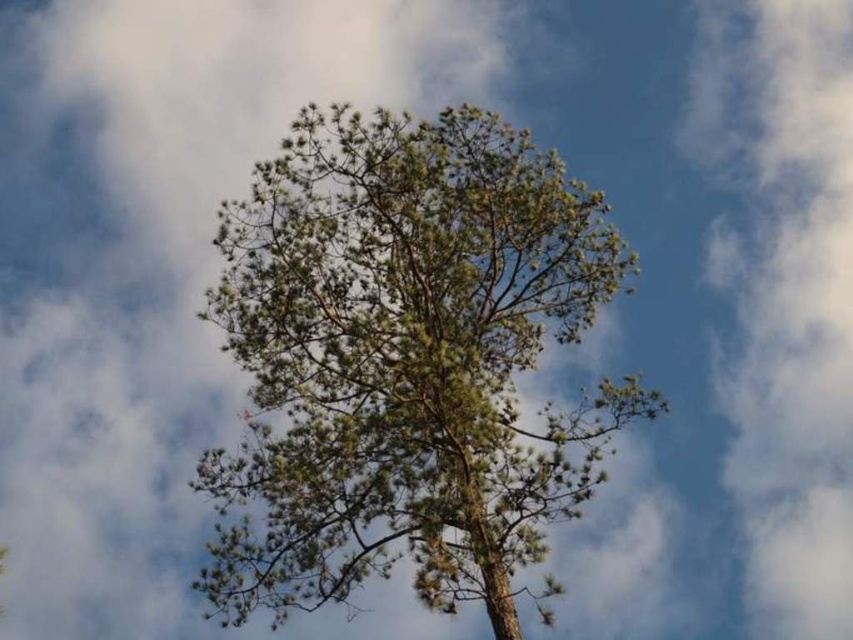
Question: In this image, where is green leafy tree at center located relative to white fluffy cloud at upper right?

Choices:
 (A) below
 (B) above

Answer: (B)

Question: Does green leafy tree at center have a lesser width compared to white fluffy cloud at upper right?

Choices:
 (A) yes
 (B) no

Answer: (B)

Question: Which object is closer to the camera taking this photo?

Choices:
 (A) green leafy tree at center
 (B) white fluffy cloud at upper right

Answer: (A)

Question: Which of the following is the farthest from the observer?

Choices:
 (A) click(x=773, y=536)
 (B) click(x=376, y=531)

Answer: (A)

Question: Among these objects, which one is farthest from the camera?

Choices:
 (A) white fluffy cloud at upper right
 (B) green leafy tree at center

Answer: (A)

Question: Does green leafy tree at center come in front of white fluffy cloud at upper right?

Choices:
 (A) yes
 (B) no

Answer: (A)